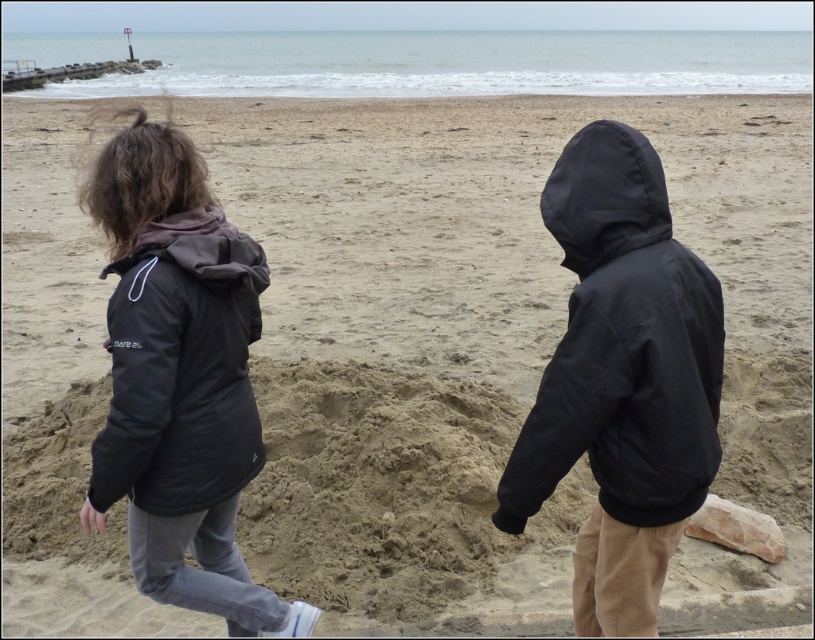
From the picture: Can you confirm if black matte jacket at left is positioned above black matte hood at upper right?

Incorrect, black matte jacket at left is not positioned above black matte hood at upper right.

Can you confirm if black matte jacket at left is smaller than black matte hood at upper right?

No.

Between point (218, 243) and point (591, 188), which one is positioned in front?

Point (591, 188) is more forward.

Locate an element on the screen. black matte jacket at left is located at coordinates tap(181, 368).

Which is in front, point (721, 321) or point (589, 192)?

Point (589, 192) is in front.

Can you confirm if black matte jacket at right is wider than black matte hood at upper right?

Indeed, black matte jacket at right has a greater width compared to black matte hood at upper right.

Where is `black matte jacket at right`? The image size is (815, 640). black matte jacket at right is located at coordinates 622,346.

Between matte black jacket at left and black matte hood at upper right, which one appears on the left side from the viewer's perspective?

matte black jacket at left is more to the left.

Can you confirm if matte black jacket at left is positioned to the right of black matte hood at upper right?

In fact, matte black jacket at left is to the left of black matte hood at upper right.

Find the location of a particular element. matte black jacket at left is located at coordinates (179, 378).